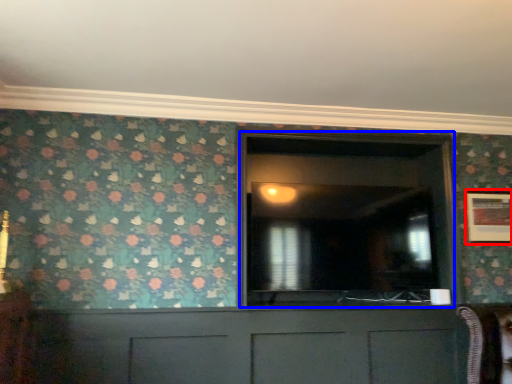
Question: Which of the following is the farthest to the observer, picture frame (highlighted by a red box) or glass door (highlighted by a blue box)?

Choices:
 (A) picture frame
 (B) glass door

Answer: (A)